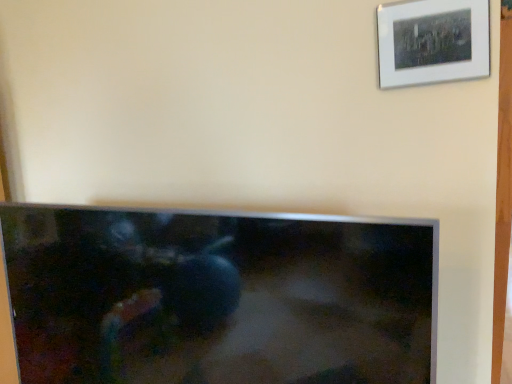
Locate an element on the screen. The width and height of the screenshot is (512, 384). white matte picture frame at upper right is located at coordinates (433, 41).

Describe the element at coordinates (433, 41) in the screenshot. I see `white matte picture frame at upper right` at that location.

Image resolution: width=512 pixels, height=384 pixels. Describe the element at coordinates (219, 297) in the screenshot. I see `matte black tv at center` at that location.

At what (x,y) coordinates should I click in order to perform the action: click on matte black tv at center. Please return your answer as a coordinate pair (x, y). This screenshot has width=512, height=384. Looking at the image, I should click on (219, 297).

Where is `white matte picture frame at upper right`? white matte picture frame at upper right is located at coordinates (433, 41).

Between matte black tv at center and white matte picture frame at upper right, which one appears on the left side from the viewer's perspective?

Positioned to the left is matte black tv at center.

Considering the positions of objects matte black tv at center and white matte picture frame at upper right in the image provided, who is in front, matte black tv at center or white matte picture frame at upper right?

matte black tv at center.

Which is closer to the camera, [278,354] or [448,51]?

Point [278,354] is closer to the camera than point [448,51].

From the image's perspective, would you say matte black tv at center is shown under white matte picture frame at upper right?

Yes, from the image's perspective, matte black tv at center is below white matte picture frame at upper right.

From a real-world perspective, is matte black tv at center below white matte picture frame at upper right?

Yes.

Considering the relative sizes of matte black tv at center and white matte picture frame at upper right in the image provided, is matte black tv at center wider than white matte picture frame at upper right?

Yes, matte black tv at center is wider than white matte picture frame at upper right.

Between matte black tv at center and white matte picture frame at upper right, which one has more height?

Standing taller between the two is matte black tv at center.

Between matte black tv at center and white matte picture frame at upper right, which one has larger size?

matte black tv at center is bigger.

Is matte black tv at center not within white matte picture frame at upper right?

Yes, matte black tv at center is not within white matte picture frame at upper right.

Are matte black tv at center and white matte picture frame at upper right located far from each other?

No, matte black tv at center is not far away from white matte picture frame at upper right.

Could you tell me if matte black tv at center is turned towards white matte picture frame at upper right?

No.

I want to click on picture frame behind the matte black tv at center, so click(433, 41).

In the scene shown: Which is more to the left, white matte picture frame at upper right or matte black tv at center?

Positioned to the left is matte black tv at center.

Which object is closer to the camera, white matte picture frame at upper right or matte black tv at center?

matte black tv at center.

Considering the positions of point (487, 22) and point (127, 349), is point (487, 22) closer or farther from the camera than point (127, 349)?

Point (487, 22) is closer to the camera than point (127, 349).

From the image's perspective, does white matte picture frame at upper right appear higher than matte black tv at center?

Indeed, from the image's perspective, white matte picture frame at upper right is shown above matte black tv at center.

From a real-world perspective, is white matte picture frame at upper right over matte black tv at center?

Indeed, from a real-world perspective, white matte picture frame at upper right stands above matte black tv at center.

Is white matte picture frame at upper right wider than matte black tv at center?

No.

Which of these two, white matte picture frame at upper right or matte black tv at center, stands shorter?

With less height is white matte picture frame at upper right.

Is white matte picture frame at upper right bigger than matte black tv at center?

Incorrect, white matte picture frame at upper right is not larger than matte black tv at center.

Can matte black tv at center be found inside white matte picture frame at upper right?

No, matte black tv at center is located outside of white matte picture frame at upper right.

Is the surface of white matte picture frame at upper right in direct contact with matte black tv at center?

white matte picture frame at upper right is not next to matte black tv at center, and they're not touching.

Does white matte picture frame at upper right turn towards matte black tv at center?

No, white matte picture frame at upper right is not oriented towards matte black tv at center.

How different are the orientations of white matte picture frame at upper right and matte black tv at center in degrees?

There is a 1.29-degree angle between the facing directions of white matte picture frame at upper right and matte black tv at center.

Identify the location of television in front of the white matte picture frame at upper right. (219, 297).

What are the coordinates of `television on the left of white matte picture frame at upper right` in the screenshot? It's located at (219, 297).

Locate an element on the screen. The image size is (512, 384). picture frame to the right of matte black tv at center is located at coordinates (433, 41).